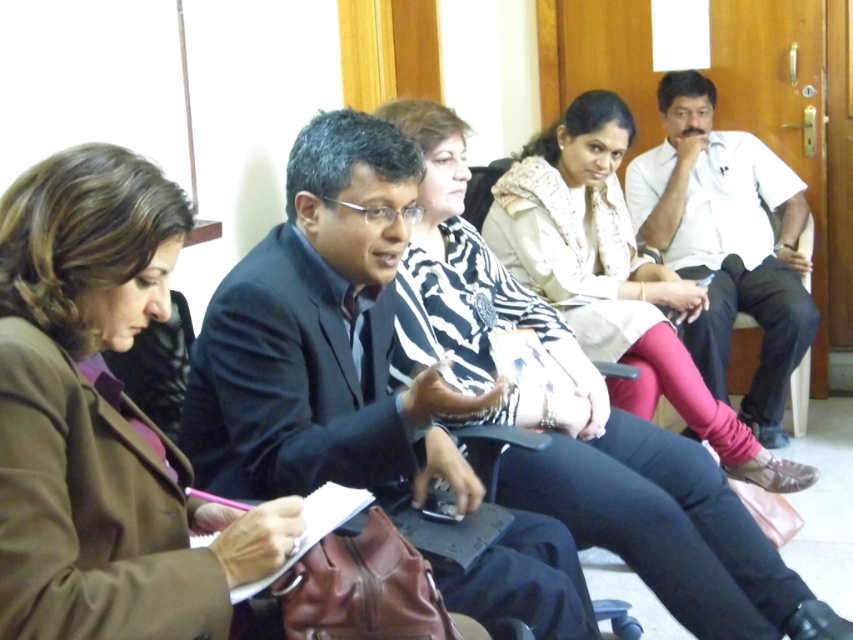
You are organizing a photo shoot and need to arrange the zebra print scarf at center and the white cotton shirt at right based on their sizes. Which item should be placed in a spot that requires less vertical space?

The zebra print scarf at center has a lesser height compared to the white cotton shirt at right, so it should be placed in the spot that requires less vertical space.